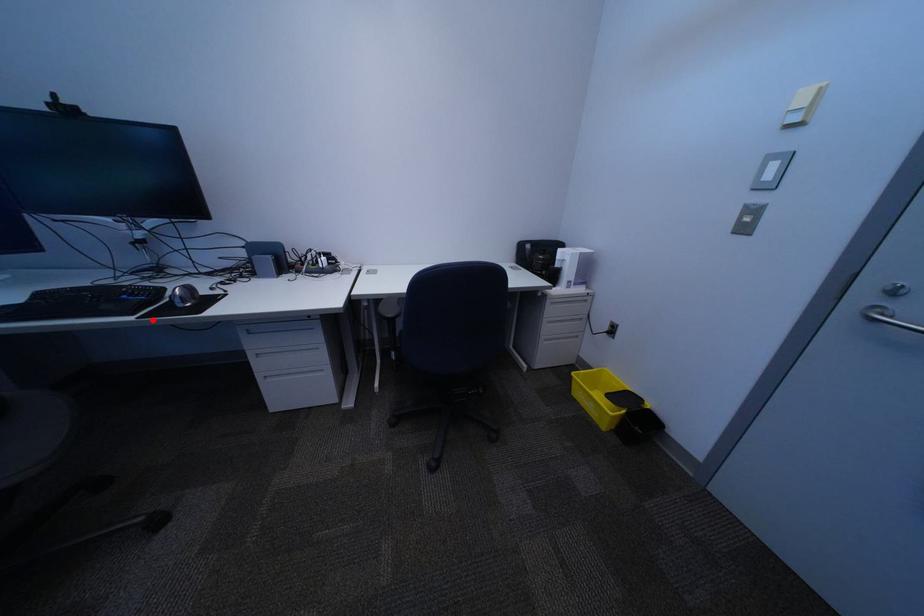
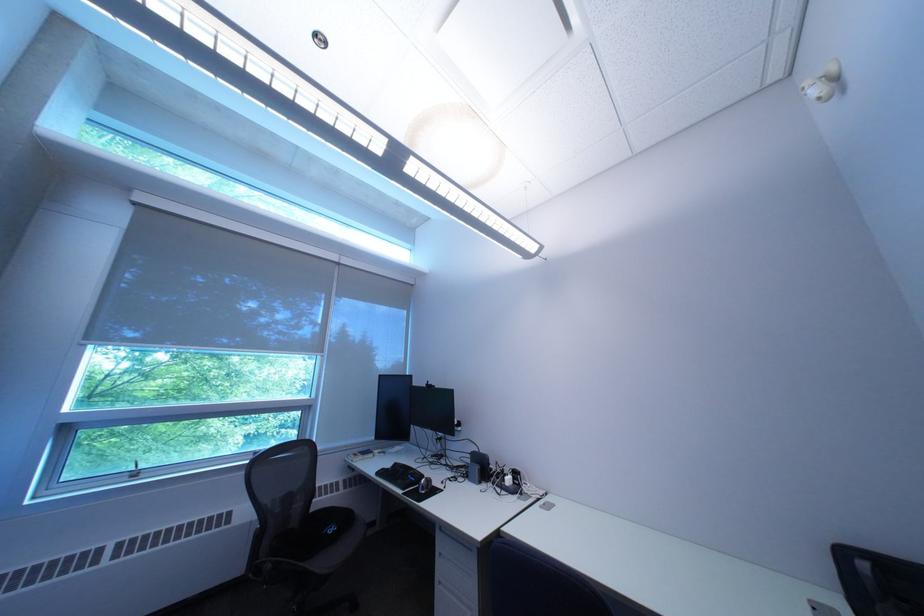
Question: I am providing you with two images of the same scene from different viewpoints. A red point is marked on the first image. Can you still see the location of the red point in image 2?

Choices:
 (A) Yes
 (B) No

Answer: (A)